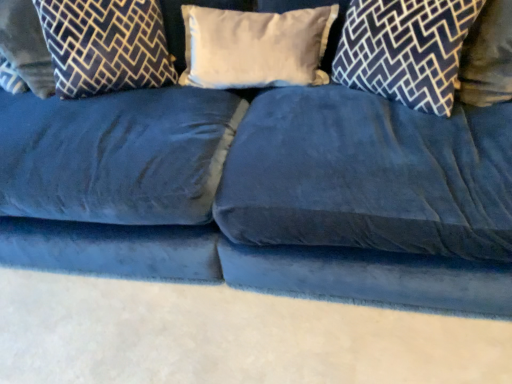
Question: From a real-world perspective, is dark blue velvet pillow at upper right, which is the 1th pillow from right to left, located beneath velvet-patterned pillow at left, which ranks as the 1th pillow in left-to-right order?

Choices:
 (A) yes
 (B) no

Answer: (B)

Question: Could you tell me if dark blue velvet pillow at upper right, which appears as the fourth pillow when viewed from the left, is turned towards velvet-patterned pillow at left, which ranks as the 1th pillow in left-to-right order?

Choices:
 (A) no
 (B) yes

Answer: (A)

Question: Is velvet-patterned pillow at left, positioned as the fourth pillow in right-to-left order, inside dark blue velvet pillow at upper right, which appears as the fourth pillow when viewed from the left?

Choices:
 (A) yes
 (B) no

Answer: (B)

Question: Does dark blue velvet pillow at upper right, which appears as the fourth pillow when viewed from the left, have a larger size compared to velvet-patterned pillow at left, positioned as the fourth pillow in right-to-left order?

Choices:
 (A) yes
 (B) no

Answer: (B)

Question: Can you confirm if dark blue velvet pillow at upper right, which appears as the fourth pillow when viewed from the left, is thinner than velvet-patterned pillow at left, positioned as the fourth pillow in right-to-left order?

Choices:
 (A) no
 (B) yes

Answer: (B)

Question: Is dark blue velvet pillow at upper left, the 2th pillow from the left, bigger or smaller than dark blue velvet pillow at upper right, which appears as the fourth pillow when viewed from the left?

Choices:
 (A) small
 (B) big

Answer: (B)

Question: Considering their positions, is dark blue velvet pillow at upper left, the 2th pillow from the left, located in front of or behind dark blue velvet pillow at upper right, which appears as the fourth pillow when viewed from the left?

Choices:
 (A) front
 (B) behind

Answer: (B)

Question: Is dark blue velvet pillow at upper left, the 2th pillow from the left, inside the boundaries of dark blue velvet pillow at upper right, which is the 1th pillow from right to left, or outside?

Choices:
 (A) inside
 (B) outside

Answer: (B)

Question: From their relative heights in the image, would you say dark blue velvet pillow at upper left, placed as the 3th pillow when sorted from right to left, is taller or shorter than dark blue velvet pillow at upper right, which appears as the fourth pillow when viewed from the left?

Choices:
 (A) tall
 (B) short

Answer: (A)

Question: Is dark blue velvet pillow at upper left, placed as the 3th pillow when sorted from right to left, inside or outside of velvet-patterned pillow at left, which ranks as the 1th pillow in left-to-right order?

Choices:
 (A) inside
 (B) outside

Answer: (B)

Question: Does point (34, 4) appear closer or farther from the camera than point (20, 61)?

Choices:
 (A) closer
 (B) farther

Answer: (A)

Question: In the image, is dark blue velvet pillow at upper left, placed as the 3th pillow when sorted from right to left, positioned in front of or behind velvet-patterned pillow at left, positioned as the fourth pillow in right-to-left order?

Choices:
 (A) behind
 (B) front

Answer: (B)

Question: Is dark blue velvet pillow at upper left, the 2th pillow from the left, wider or thinner than velvet-patterned pillow at left, positioned as the fourth pillow in right-to-left order?

Choices:
 (A) wide
 (B) thin

Answer: (B)

Question: From a real-world perspective, relative to white soft pillow at center, which is counted as the second pillow, starting from the right, is dark blue velvet pillow at upper left, the 2th pillow from the left, vertically above or below?

Choices:
 (A) above
 (B) below

Answer: (A)

Question: In the image, is dark blue velvet pillow at upper left, placed as the 3th pillow when sorted from right to left, on the left side or the right side of white soft pillow at center, which is counted as the second pillow, starting from the right?

Choices:
 (A) right
 (B) left

Answer: (B)